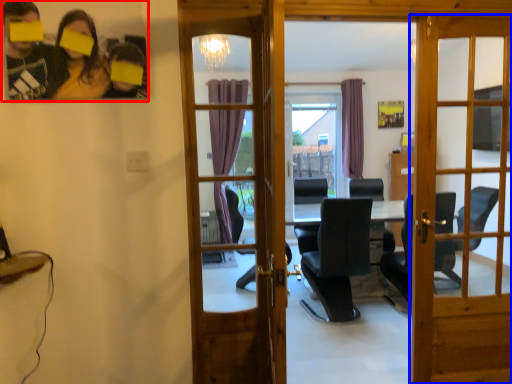
Question: Among these objects, which one is farthest to the camera, couple (highlighted by a red box) or door (highlighted by a blue box)?

Choices:
 (A) couple
 (B) door

Answer: (B)